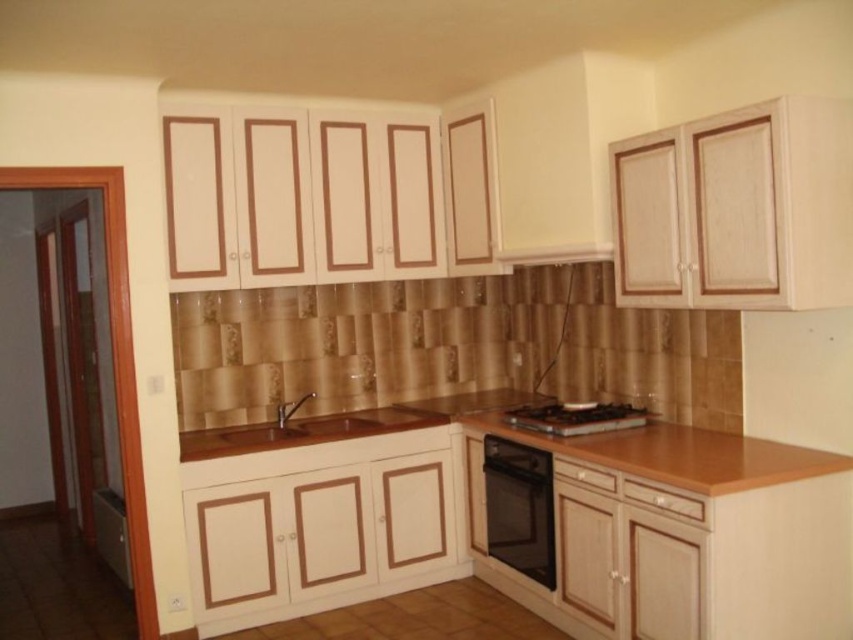
You are a chef preparing to place a large pot on the stove. The pot has a diameter of 30 cm. Given the black glass gas stove at center and the matte wood sink at center, can you determine if the stove is large enough to accommodate the pot?

The black glass gas stove at center is smaller than the matte wood sink at center. Since the stove is smaller, it may not have enough space to safely place a 30 cm diameter pot. Consider using a larger cooking surface or a different appliance.

You are a chef preparing to place a large pot on the wooden countertop at center and the black glass gas stove at center. Which surface can accommodate the pot more comfortably?

The wooden countertop at center is larger in size than the black glass gas stove at center, so the pot will fit more comfortably on the wooden countertop at center.

You are standing in the kitchen and want to reach both the point at location [619,500] and the point at [532,426]. Which point will you reach first if you move straight forward?

You will reach the point at [619,500] first because it is closer to you than the point at [532,426].